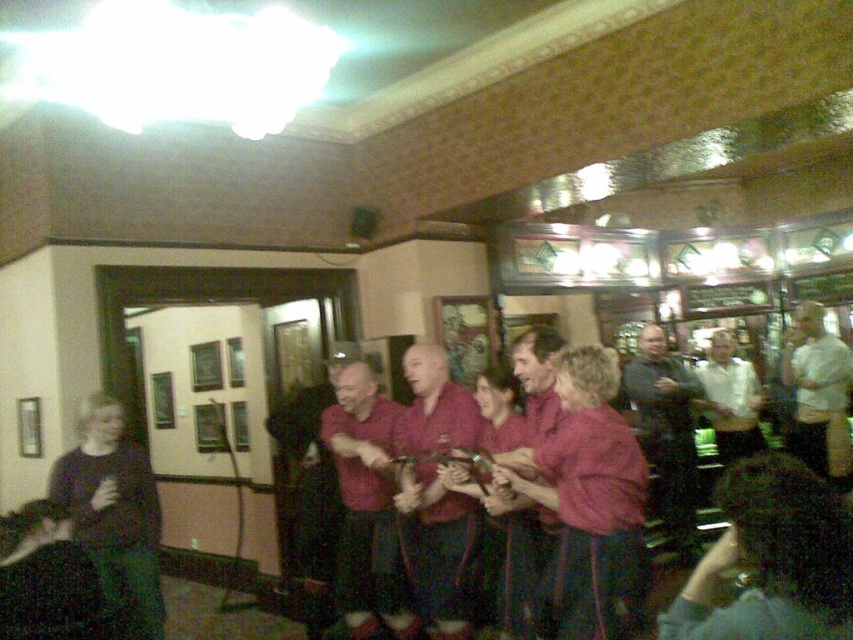
Identify the location of matte red shirt at center. (439, 548).

Locate an element on the screen. The height and width of the screenshot is (640, 853). matte red shirt at center is located at coordinates (439, 548).

The height and width of the screenshot is (640, 853). I want to click on matte red shirt at center, so click(x=439, y=548).

Can you confirm if maroon fabric shirt at center is positioned to the right of white shirt at center?

Incorrect, maroon fabric shirt at center is not on the right side of white shirt at center.

Consider the image. Who is more distant from viewer, (416,621) or (840,364)?

The point (840,364) is behind.

Which is in front, point (375, 608) or point (805, 371)?

Point (375, 608)

The height and width of the screenshot is (640, 853). What are the coordinates of `maroon fabric shirt at center` in the screenshot? It's located at (366, 506).

Is matte red shirt at center to the left of maroon fabric shirt at center from the viewer's perspective?

No, matte red shirt at center is not to the left of maroon fabric shirt at center.

Where is `matte red shirt at center`? matte red shirt at center is located at coordinates (439, 548).